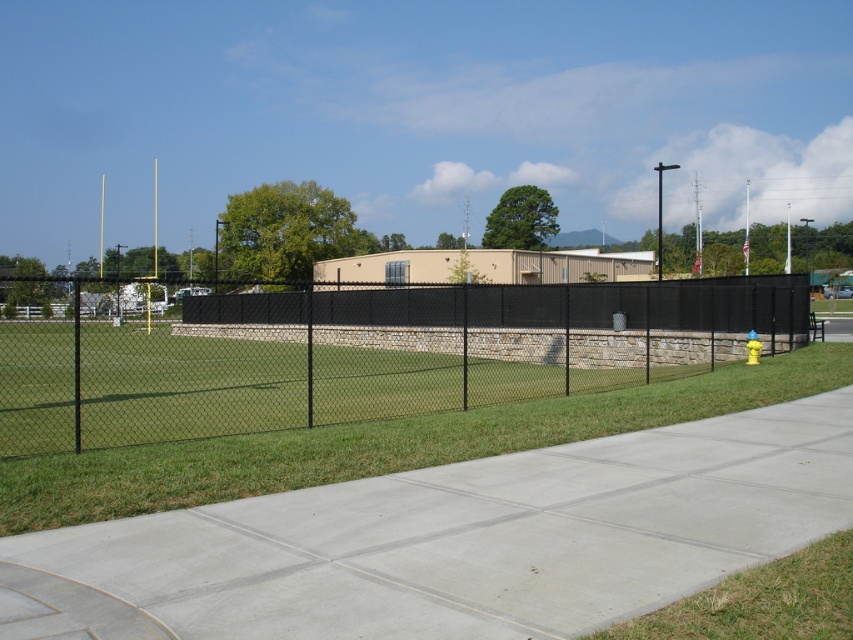
Which is more to the right, black chain-link fence at center or green grass at lower right?

green grass at lower right

Between point (44, 420) and point (833, 582), which one is positioned behind?

The point (44, 420) is behind.

In the scene shown: Who is more forward, (711,298) or (813,616)?

Point (813,616) is in front.

I want to click on black chain-link fence at center, so click(x=369, y=356).

Does gray concrete sidewalk at center have a greater width compared to black chain-link fence at center?

In fact, gray concrete sidewalk at center might be narrower than black chain-link fence at center.

Image resolution: width=853 pixels, height=640 pixels. Describe the element at coordinates (456, 540) in the screenshot. I see `gray concrete sidewalk at center` at that location.

Describe the element at coordinates (456, 540) in the screenshot. This screenshot has height=640, width=853. I see `gray concrete sidewalk at center` at that location.

The height and width of the screenshot is (640, 853). What are the coordinates of `gray concrete sidewalk at center` in the screenshot? It's located at (456, 540).

Is point (727, 426) less distant than point (851, 552)?

That is False.

Is gray concrete sidewalk at center further to the viewer compared to green grass at lower right?

Yes, gray concrete sidewalk at center is behind green grass at lower right.

This screenshot has width=853, height=640. What are the coordinates of `gray concrete sidewalk at center` in the screenshot? It's located at (456, 540).